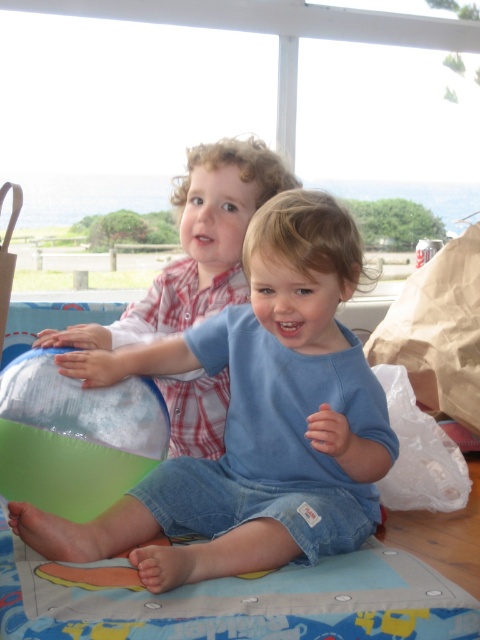
You are a photographer trying to capture a photo of both children in the scene. You notice two points marked in the image. The first point is at coordinates point (242, 296) and the second is at point (103, 474). Which point is closer to the camera so that you can focus on it first?

Point (242, 296) is further to the viewer than point (103, 474), so the photographer should focus on point (242, 296) first since it is closer to the camera.

You are a photographer trying to capture the blue denim shorts at center in the image. According to the coordinates provided, where exactly should you focus your camera lens to ensure the shorts are in the center of the frame?

You should focus your camera lens at the coordinates point (252, 419) to ensure the blue denim shorts at center are in the center of the frame.